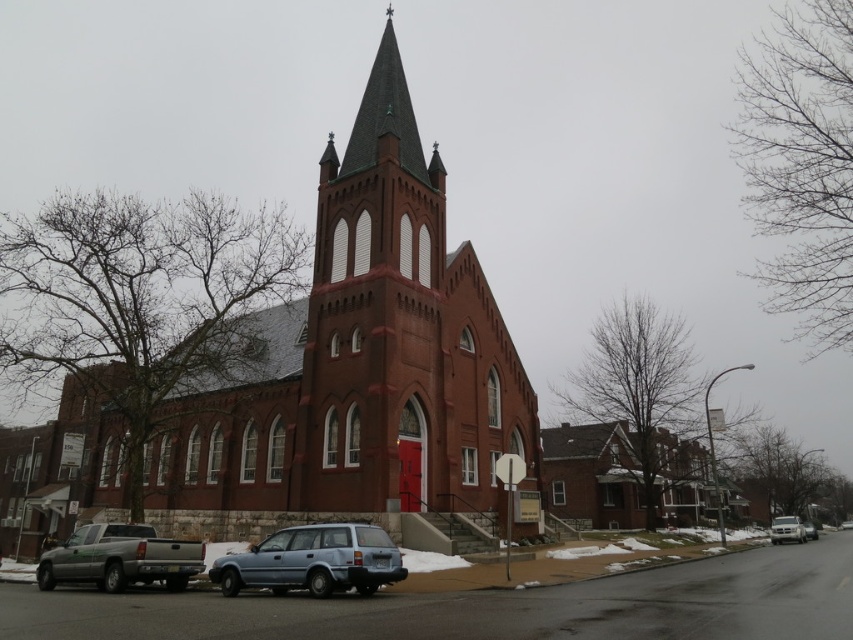
Between light blue matte wagon at lower center and metallic silver car at center, which one appears on the right side from the viewer's perspective?

metallic silver car at center

Is light blue matte wagon at lower center wider than metallic silver car at center?

Correct, the width of light blue matte wagon at lower center exceeds that of metallic silver car at center.

Does point (281, 534) come closer to viewer compared to point (846, 520)?

Yes, point (281, 534) is closer to viewer.

What are the coordinates of `light blue matte wagon at lower center` in the screenshot? It's located at (312, 561).

Is the position of smooth brick tower at center more distant than that of light blue matte wagon at lower center?

Yes.

Who is lower down, smooth brick tower at center or light blue matte wagon at lower center?

light blue matte wagon at lower center

Which is behind, point (390, 440) or point (294, 570)?

The point (390, 440) is more distant.

The width and height of the screenshot is (853, 640). In order to click on smooth brick tower at center in this screenshot , I will do `click(373, 298)`.

Does point (419, 346) come behind point (840, 525)?

No, it is in front of (840, 525).

Is smooth brick tower at center thinner than metallic silver car at center?

In fact, smooth brick tower at center might be wider than metallic silver car at center.

Does point (347, 305) come behind point (846, 522)?

That is False.

Image resolution: width=853 pixels, height=640 pixels. I want to click on smooth brick tower at center, so click(373, 298).